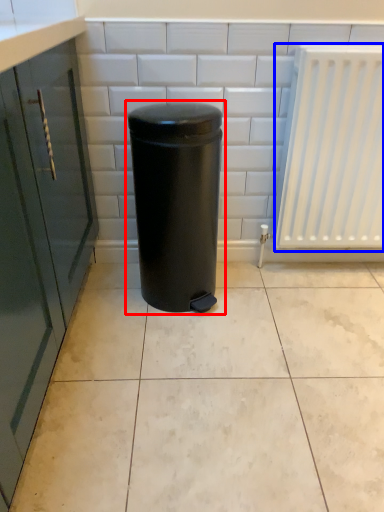
Question: Which of the following is the farthest to the observer, waste container (highlighted by a red box) or radiator (highlighted by a blue box)?

Choices:
 (A) waste container
 (B) radiator

Answer: (B)